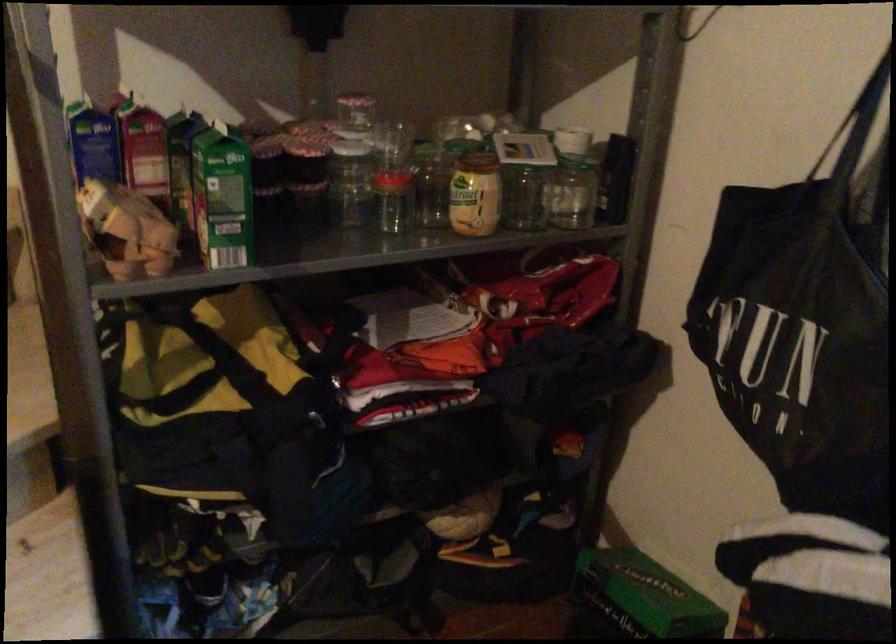
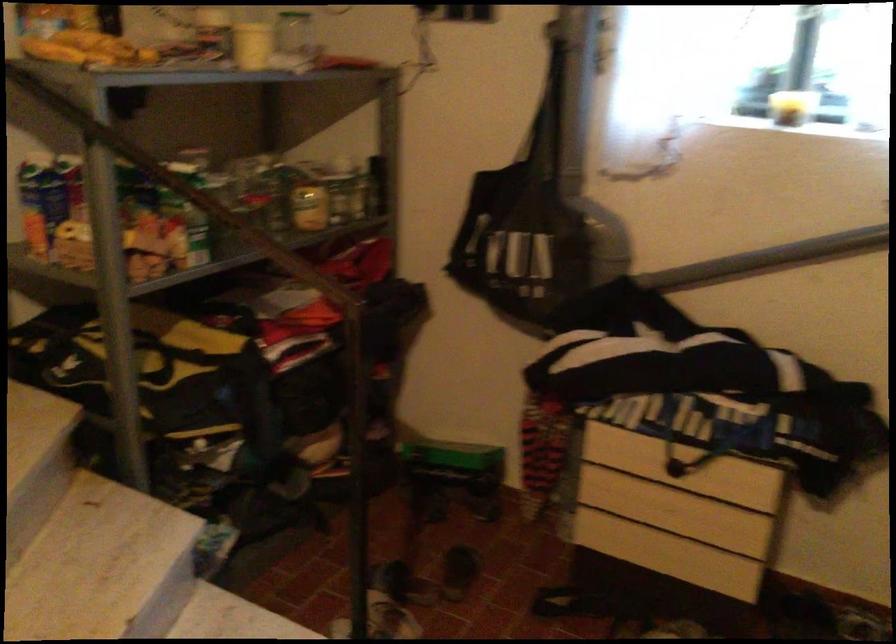
The point at (471, 198) is marked in the first image. Where is the corresponding point in the second image?

(309, 205)